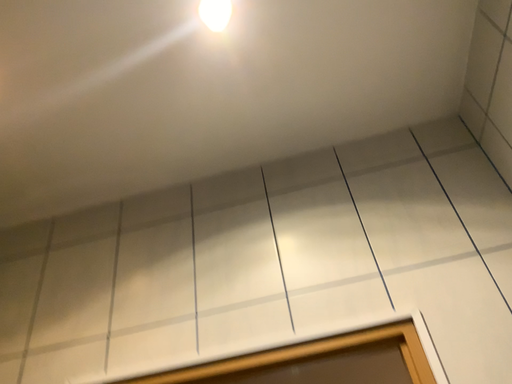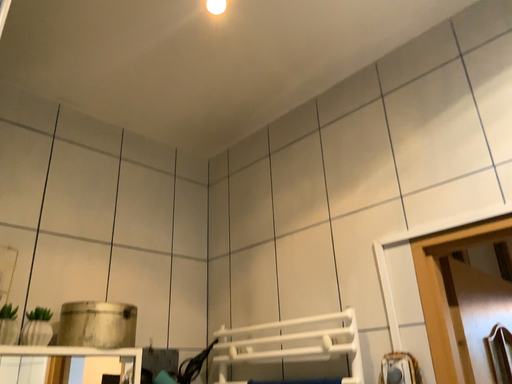
Question: How did the camera likely rotate when shooting the video?

Choices:
 (A) rotated right
 (B) rotated left

Answer: (B)